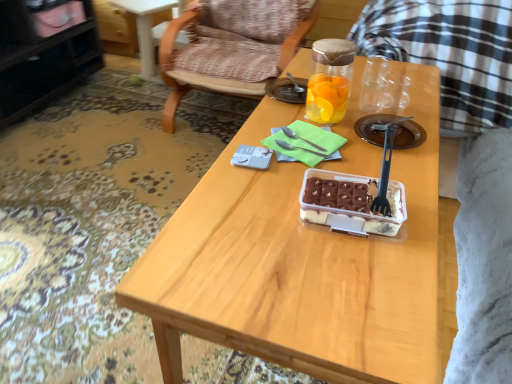
Question: Could you tell me if wooden table at center is turned towards black plastic fork at center, which is the first fork in front-to-back order?

Choices:
 (A) no
 (B) yes

Answer: (A)

Question: Is wooden table at center not close to black plastic fork at center, which is the first fork in front-to-back order?

Choices:
 (A) yes
 (B) no

Answer: (B)

Question: Is wooden table at center beside black plastic fork at center, the 3th fork when ordered from back to front?

Choices:
 (A) yes
 (B) no

Answer: (B)

Question: Considering the relative sizes of wooden table at center and black plastic fork at center, which is the first fork in front-to-back order, in the image provided, is wooden table at center wider than black plastic fork at center, which is the first fork in front-to-back order,?

Choices:
 (A) yes
 (B) no

Answer: (A)

Question: Considering the relative sizes of wooden table at center and black plastic fork at center, the 3th fork when ordered from back to front, in the image provided, is wooden table at center thinner than black plastic fork at center, the 3th fork when ordered from back to front,?

Choices:
 (A) no
 (B) yes

Answer: (A)

Question: Is wooden table at center shorter than black plastic fork at center, which is the first fork in front-to-back order?

Choices:
 (A) no
 (B) yes

Answer: (A)

Question: Does black plastic fork at center, which is the first fork in front-to-back order, touch translucent plastic container at center?

Choices:
 (A) yes
 (B) no

Answer: (A)

Question: Are black plastic fork at center, the 3th fork when ordered from back to front, and translucent plastic container at center far apart?

Choices:
 (A) no
 (B) yes

Answer: (A)

Question: Is black plastic fork at center, the 3th fork when ordered from back to front, facing towards translucent plastic container at center?

Choices:
 (A) no
 (B) yes

Answer: (B)

Question: Is black plastic fork at center, the 3th fork when ordered from back to front, further to the viewer compared to translucent plastic container at center?

Choices:
 (A) no
 (B) yes

Answer: (B)

Question: Considering the relative sizes of black plastic fork at center, which is the first fork in front-to-back order, and translucent plastic container at center in the image provided, is black plastic fork at center, which is the first fork in front-to-back order, thinner than translucent plastic container at center?

Choices:
 (A) no
 (B) yes

Answer: (B)

Question: Considering the relative sizes of black plastic fork at center, which is the first fork in front-to-back order, and translucent plastic container at center in the image provided, is black plastic fork at center, which is the first fork in front-to-back order, bigger than translucent plastic container at center?

Choices:
 (A) no
 (B) yes

Answer: (A)

Question: From the image's perspective, does black glossy cabinet at upper left appear lower than black plastic fork at center, which is the first fork in front-to-back order?

Choices:
 (A) no
 (B) yes

Answer: (A)